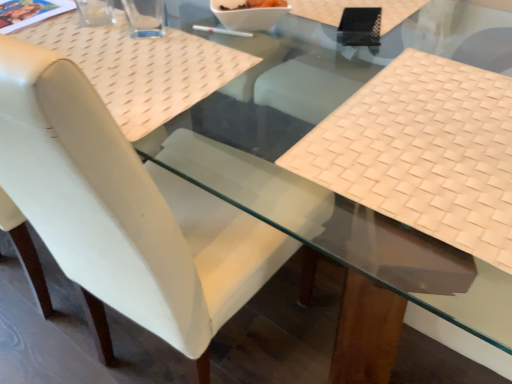
Question: In terms of height, does transparent glass cup at upper left, the second clear positioned from the right, look taller or shorter compared to transparent glass at upper left, the 2th clear when ordered from left to right?

Choices:
 (A) short
 (B) tall

Answer: (A)

Question: From a real-world perspective, is transparent glass cup at upper left, marked as the 1th clear in a left-to-right arrangement, positioned above or below transparent glass at upper left, the first clear when ordered from right to left?

Choices:
 (A) above
 (B) below

Answer: (B)

Question: Which object is positioned farthest from the white leather chair at center?

Choices:
 (A) white plastic chopstick at center
 (B) white glossy bowl at center
 (C) transparent glass cup at upper left, marked as the 1th clear in a left-to-right arrangement
 (D) beige woven mat at right
 (E) transparent glass at upper left, the first clear when ordered from right to left

Answer: (C)

Question: Based on their relative distances, which object is nearer to the white plastic chopstick at center?

Choices:
 (A) transparent glass at upper left, the first clear when ordered from right to left
 (B) beige woven mat at right
 (C) transparent glass cup at upper left, marked as the 1th clear in a left-to-right arrangement
 (D) white glossy bowl at center
 (E) white leather chair at center

Answer: (D)